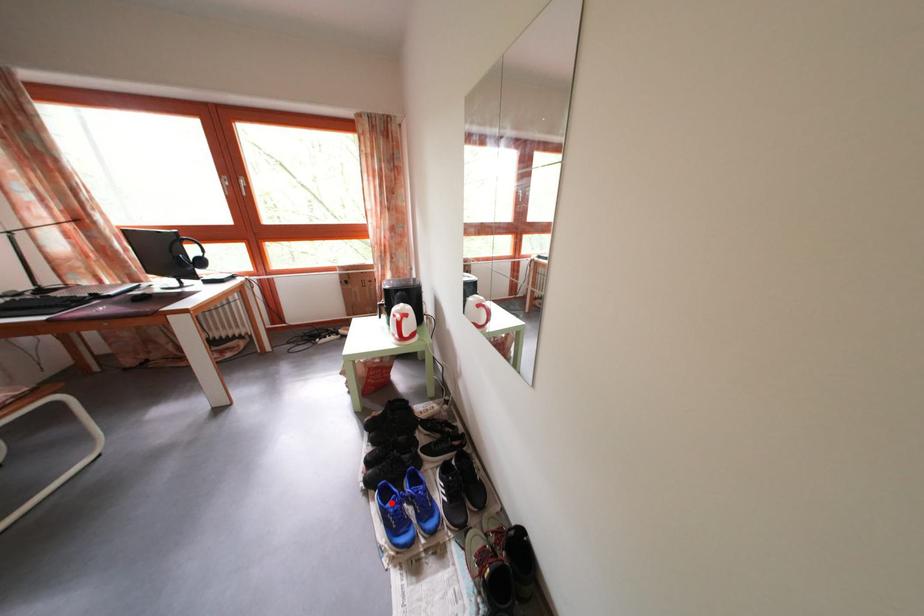
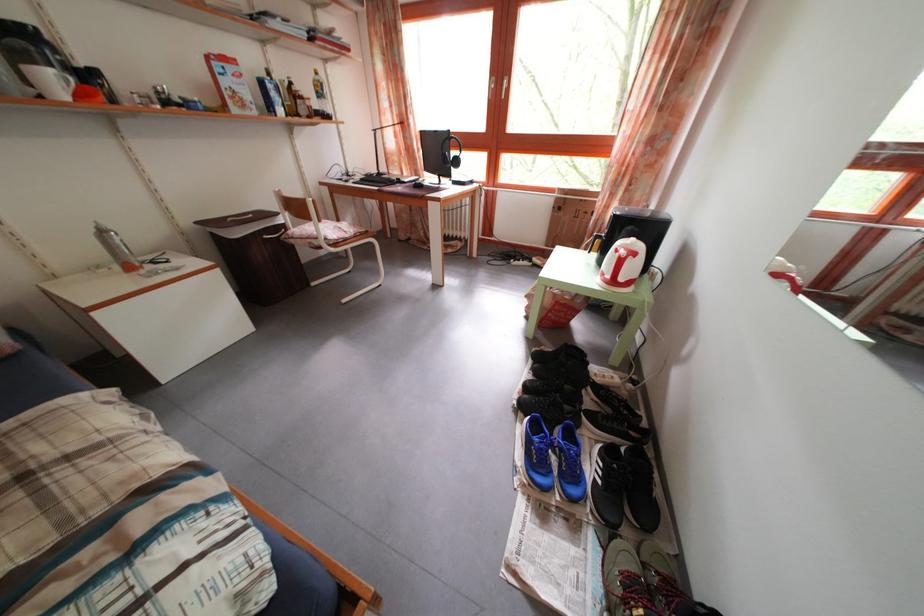
Question: I am providing you with two images of the same scene from different viewpoints. In image1, a red point is highlighted. Considering the same 3D point in image2, which of the following is correct?

Choices:
 (A) It is closer
 (B) It is farther

Answer: (A)